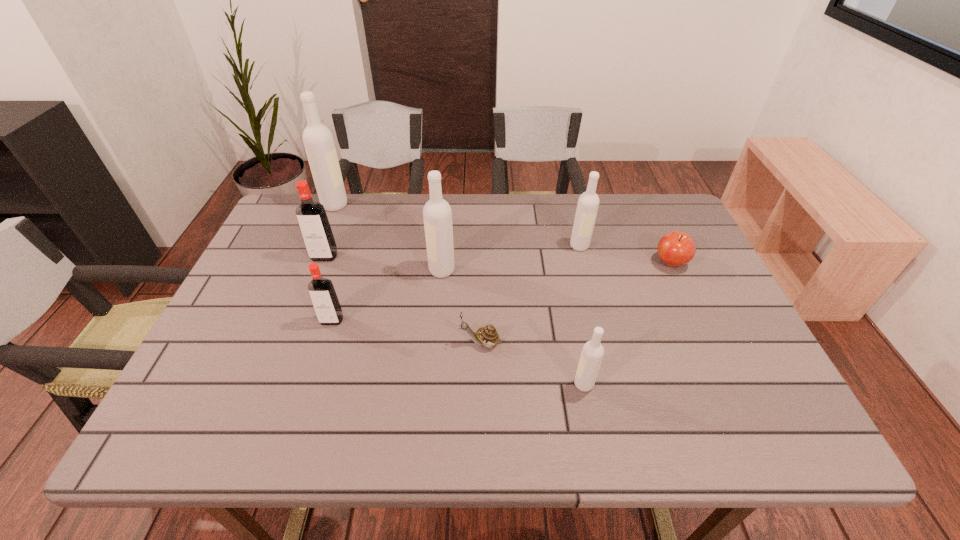
Where is `object that is the sixth closest to the fifth object from right to left`? object that is the sixth closest to the fifth object from right to left is located at coordinates (592, 353).

Where is `the third closest vodka to the rightmost object`? the third closest vodka to the rightmost object is located at coordinates (437, 215).

Identify which vodka is the fourth nearest to the leftmost white vodka. Please provide its 2D coordinates. Your answer should be formatted as a tuple, i.e. [(x, y)], where the tuple contains the x and y coordinates of a point satisfying the conditions above.

[(588, 202)]

Locate which white vodka is the fourth closest to the rightmost object. Please provide its 2D coordinates. Your answer should be formatted as a tuple, i.e. [(x, y)], where the tuple contains the x and y coordinates of a point satisfying the conditions above.

[(318, 140)]

You are a GUI agent. You are given a task and a screenshot of the screen. Output one action in this format:
    pyautogui.click(x=<x>, y=<y>)
    Task: Click on the second closest white vodka to the third biggest white vodka
    Image resolution: width=960 pixels, height=540 pixels.
    Given the screenshot: What is the action you would take?
    pyautogui.click(x=592, y=353)

I want to click on vacant space that satisfies the following two spatial constraints: 1. on the front and back of the second tallest object; 2. on the right side of the bigger red vodka, so 320,270.

I want to click on free space that satisfies the following two spatial constraints: 1. on the back side of the apple; 2. on the left side of the fourth object from left to right, so click(443, 262).

Identify the location of free space that satisfies the following two spatial constraints: 1. on the front side of the farthest vodka; 2. on the right side of the apple. The height and width of the screenshot is (540, 960). (311, 262).

At what (x,y) coordinates should I click in order to perform the action: click on vacant space that satisfies the following two spatial constraints: 1. on the front and back of the nearest vodka; 2. on the left side of the farther red vodka. Please return your answer as a coordinate pair (x, y). This screenshot has width=960, height=540. Looking at the image, I should click on (276, 384).

At what (x,y) coordinates should I click in order to perform the action: click on free spot that satisfies the following two spatial constraints: 1. on the front side of the rightmost object; 2. on the face of the snail. Please return your answer as a coordinate pair (x, y). The image size is (960, 540). Looking at the image, I should click on (708, 343).